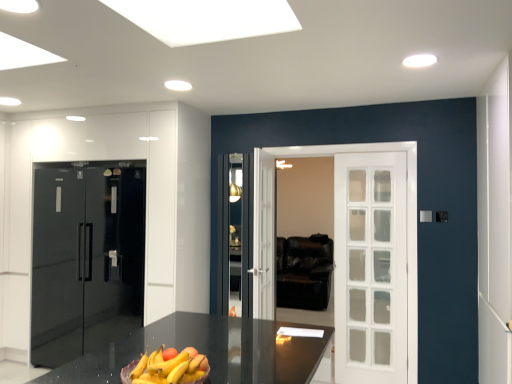
Question: From the image's perspective, relative to yellow matte bananas at center, is black glossy refrigerator at left above or below?

Choices:
 (A) above
 (B) below

Answer: (B)

Question: Is point (121, 160) positioned closer to the camera than point (198, 355)?

Choices:
 (A) farther
 (B) closer

Answer: (A)

Question: Is black glossy refrigerator at left bigger or smaller than yellow matte bananas at center?

Choices:
 (A) small
 (B) big

Answer: (B)

Question: From the image's perspective, is yellow matte bananas at center above or below black glossy refrigerator at left?

Choices:
 (A) below
 (B) above

Answer: (B)

Question: From a real-world perspective, is yellow matte bananas at center positioned above or below black glossy refrigerator at left?

Choices:
 (A) below
 (B) above

Answer: (A)

Question: In the image, is yellow matte bananas at center positioned in front of or behind black glossy refrigerator at left?

Choices:
 (A) behind
 (B) front

Answer: (B)

Question: Is yellow matte bananas at center bigger or smaller than black glossy refrigerator at left?

Choices:
 (A) big
 (B) small

Answer: (B)